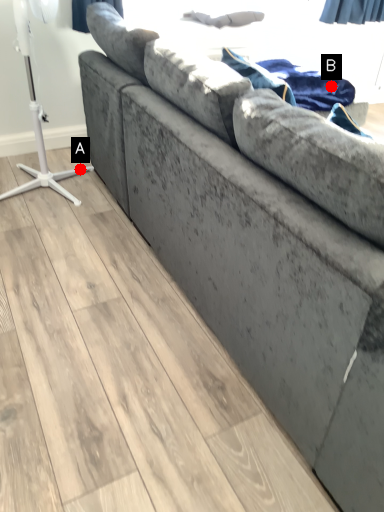
Question: Two points are circled on the image, labeled by A and B beside each circle. Which point appears farthest from the camera in this image?

Choices:
 (A) A is further
 (B) B is further

Answer: (A)